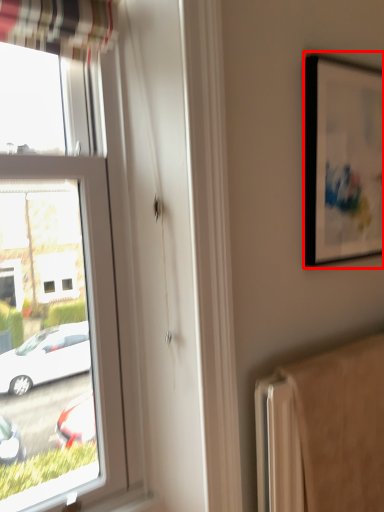
Question: Where is picture frame (annotated by the red box) located in relation to radiator in the image?

Choices:
 (A) right
 (B) left

Answer: (A)